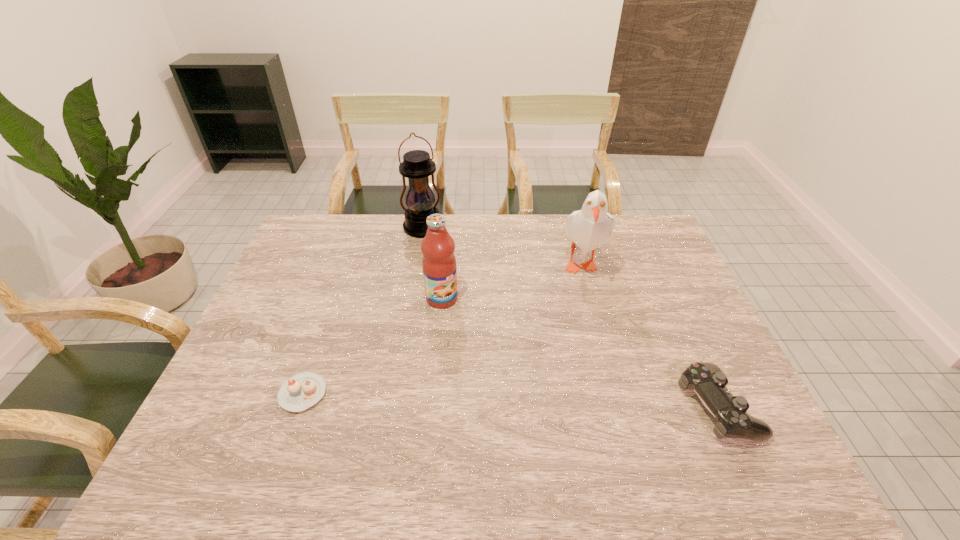
This screenshot has width=960, height=540. Identify the location of vacant space on the desktop that is between the cupcake and the second shortest object and is positioned on the front label of the fruit juice. (533, 401).

Identify the location of free space on the desktop that is between the cupcake and the fourth tallest object and is positioned at the beak of the gull. This screenshot has height=540, width=960. (452, 398).

Where is `free spot on the desktop that is between the cupcake and the control and is positioned above the lantern, indicating its light source`? free spot on the desktop that is between the cupcake and the control and is positioned above the lantern, indicating its light source is located at coordinates (505, 400).